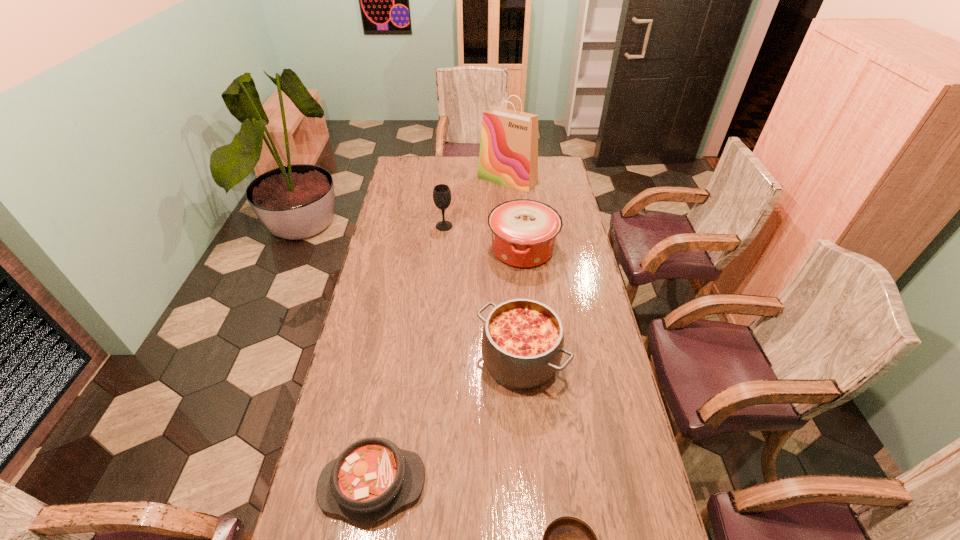
Locate an element on the screen. vacant area in the image that satisfies the following two spatial constraints: 1. on the back side of the third nearest object; 2. on the right side of the shortest casserole is located at coordinates (394, 361).